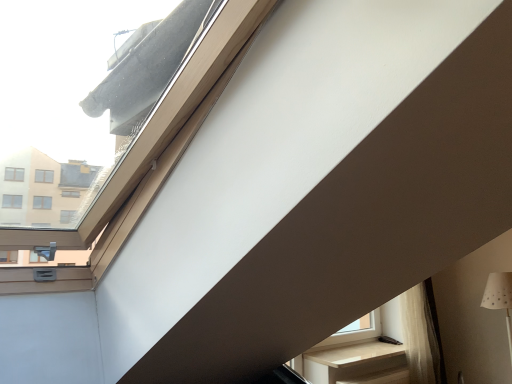
What do you see at coordinates (500, 298) in the screenshot? The image size is (512, 384). I see `white paper lampshade at lower right` at bounding box center [500, 298].

The image size is (512, 384). I want to click on white paper lampshade at lower right, so click(500, 298).

The width and height of the screenshot is (512, 384). I want to click on white paper lampshade at lower right, so click(x=500, y=298).